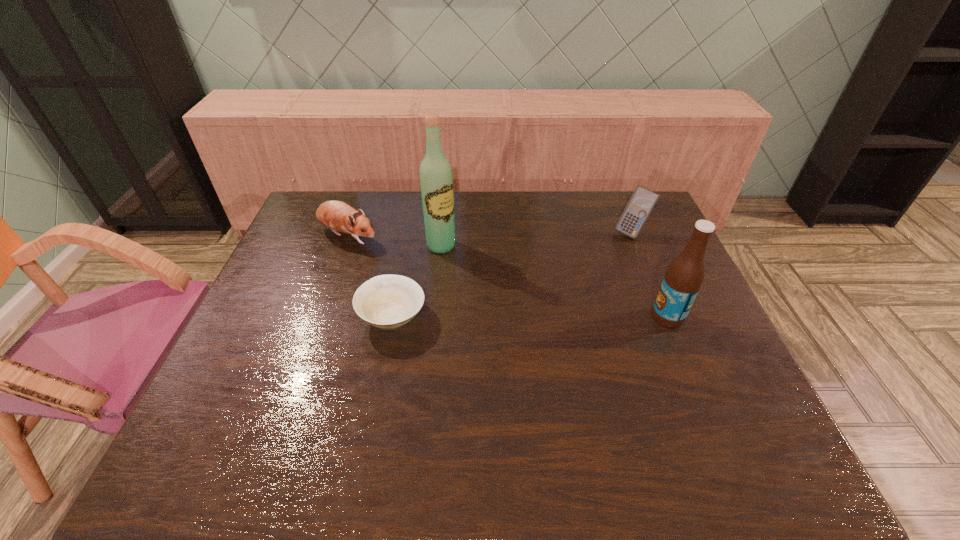
I want to click on free space on the desktop that is between the bowl and the beer bottle and is positioned on the front-facing side of the tallest object, so [x=522, y=316].

At what (x,y) coordinates should I click in order to perform the action: click on vacant space on the desktop that is between the bowl and the beer bottle and is positioned on the front-facing side of the third shortest object. Please return your answer as a coordinate pair (x, y). The width and height of the screenshot is (960, 540). Looking at the image, I should click on tap(564, 316).

In order to click on free spot on the desktop that is between the bowl and the beer bottle and is positioned at the face of the hamster in this screenshot , I will do `click(492, 316)`.